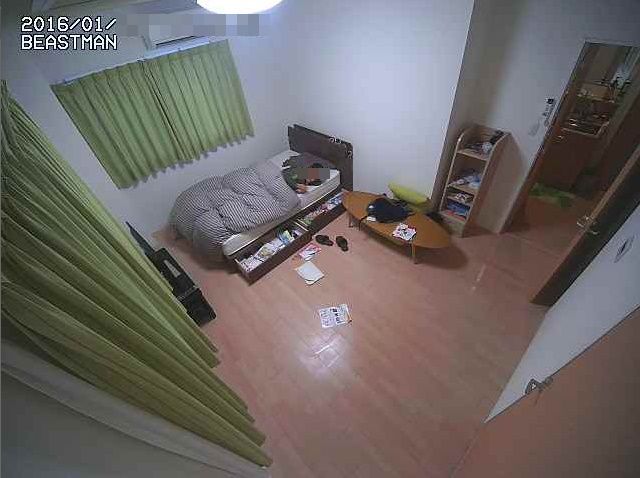
The height and width of the screenshot is (478, 640). What are the coordinates of `reflected white light on floor` in the screenshot? It's located at pyautogui.click(x=321, y=349).